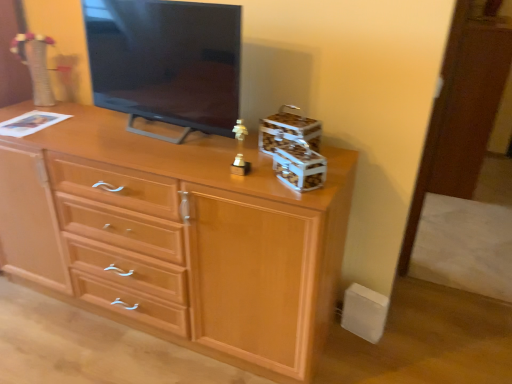
Image resolution: width=512 pixels, height=384 pixels. I want to click on vacant area on top of light wood chest of drawers at center (from a real-world perspective), so click(x=134, y=142).